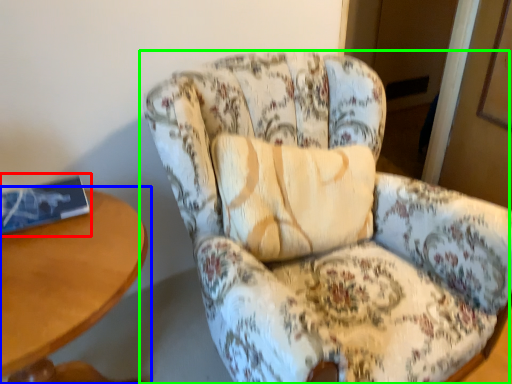
Question: Estimate the real-world distances between objects in this image. Which object is closer to book (highlighted by a red box), table (highlighted by a blue box) or chair (highlighted by a green box)?

Choices:
 (A) table
 (B) chair

Answer: (A)